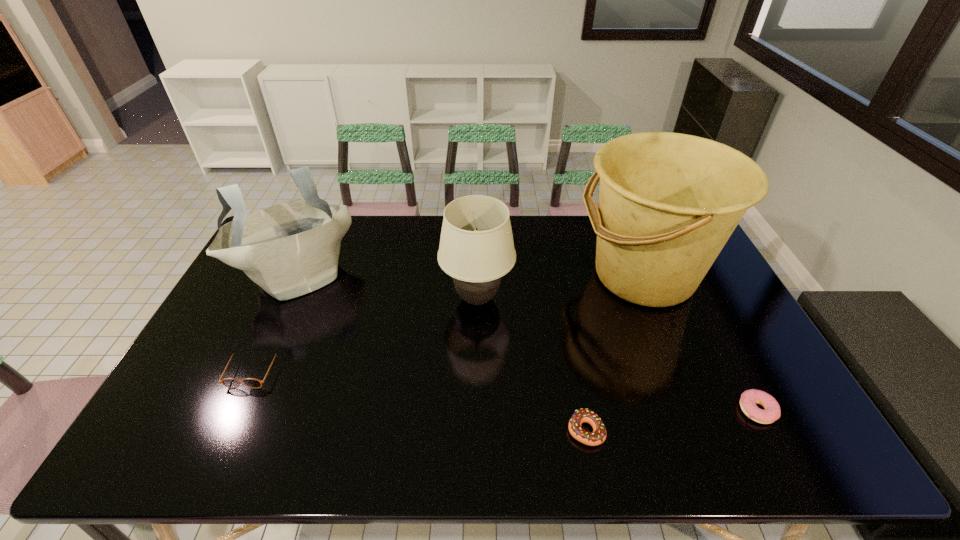
In order to click on bucket in this screenshot , I will do `click(668, 202)`.

Identify the location of shopping bag. (290, 249).

Locate an element on the screen. This screenshot has width=960, height=540. lampshade is located at coordinates (476, 249).

Locate an element on the screen. The width and height of the screenshot is (960, 540). sunglasses is located at coordinates (232, 383).

You are a GUI agent. You are given a task and a screenshot of the screen. Output one action in this format:
    pyautogui.click(x=<x>, y=<y>)
    Task: Click on the left doughnut
    
    Given the screenshot: What is the action you would take?
    pyautogui.click(x=598, y=436)

Where is `the right doughnut`? The width and height of the screenshot is (960, 540). the right doughnut is located at coordinates (772, 412).

The width and height of the screenshot is (960, 540). Find the location of `vacant space located 0.270m on the side of the bucket with the handle`. vacant space located 0.270m on the side of the bucket with the handle is located at coordinates (494, 275).

At what (x,y) coordinates should I click in order to perform the action: click on vacant space located on the side of the bucket with the handle. Please return your answer as a coordinate pair (x, y). Looking at the image, I should click on (458, 275).

This screenshot has height=540, width=960. What are the coordinates of `free space located on the side of the bucket with the handle` in the screenshot? It's located at (524, 275).

What are the coordinates of `vacant region located 0.110m on the back of the shopping bag` in the screenshot? It's located at (319, 232).